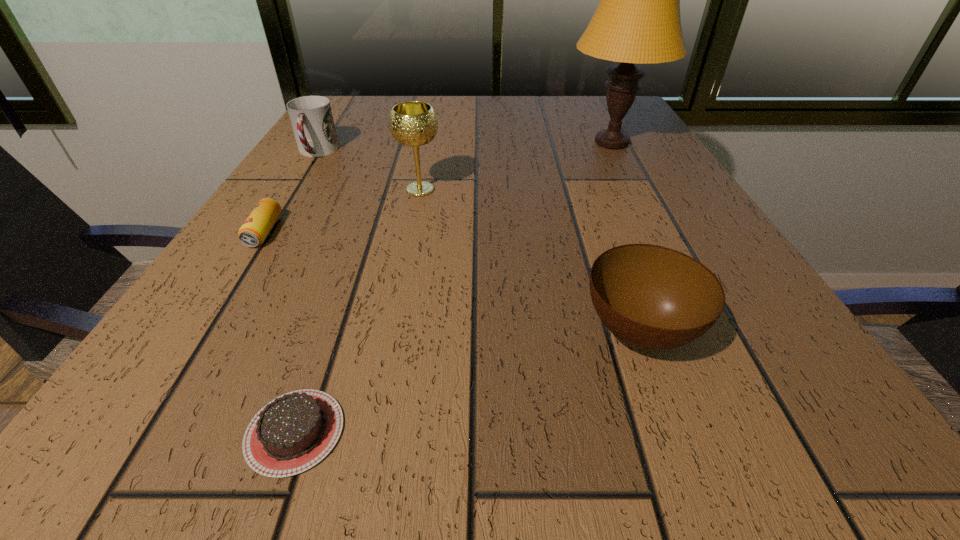
Where is `chocolate cake that is positioned at the left edge`? chocolate cake that is positioned at the left edge is located at coordinates (295, 431).

The width and height of the screenshot is (960, 540). In order to click on lampshade at the right edge in this screenshot , I will do `click(637, 20)`.

Locate an element on the screen. This screenshot has height=540, width=960. bowl at the right edge is located at coordinates (652, 297).

Image resolution: width=960 pixels, height=540 pixels. In order to click on object present at the near left corner in this screenshot , I will do `click(295, 431)`.

Locate an element on the screen. This screenshot has width=960, height=540. object situated at the far right corner is located at coordinates (637, 20).

Identify the location of vacant area at the far edge. This screenshot has width=960, height=540. point(479,104).

Identify the location of vacant space at the near edge. (372, 440).

Where is `blank space at the left edge`? blank space at the left edge is located at coordinates (297, 310).

Find the location of a particular element. The image size is (960, 540). vacant point at the right edge is located at coordinates (638, 159).

Find the location of a particular element. vacant region at the far left corner of the desktop is located at coordinates (375, 99).